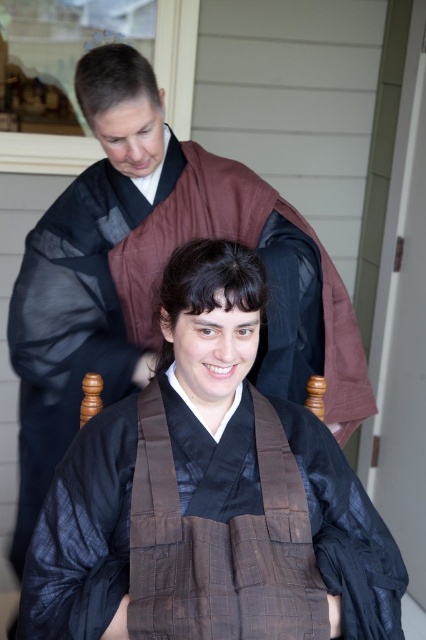
Question: Does brown quilted fabric robe at center appear on the left side of brown silk kimono at center?

Choices:
 (A) yes
 (B) no

Answer: (B)

Question: Among these points, which one is farthest from the camera?

Choices:
 (A) (178, 435)
 (B) (34, 416)

Answer: (B)

Question: From the image, what is the correct spatial relationship of brown quilted fabric robe at center in relation to brown silk kimono at center?

Choices:
 (A) left
 (B) right

Answer: (B)

Question: Does brown quilted fabric robe at center come in front of brown silk kimono at center?

Choices:
 (A) yes
 (B) no

Answer: (A)

Question: Among these points, which one is farthest from the camera?

Choices:
 (A) (74, 310)
 (B) (170, 384)

Answer: (A)

Question: Which object is closer to the camera taking this photo?

Choices:
 (A) brown quilted fabric robe at center
 (B) brown silk kimono at center

Answer: (A)